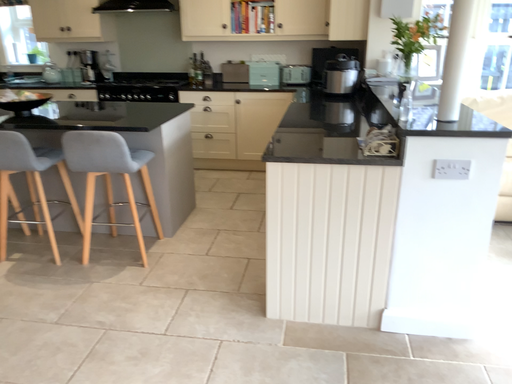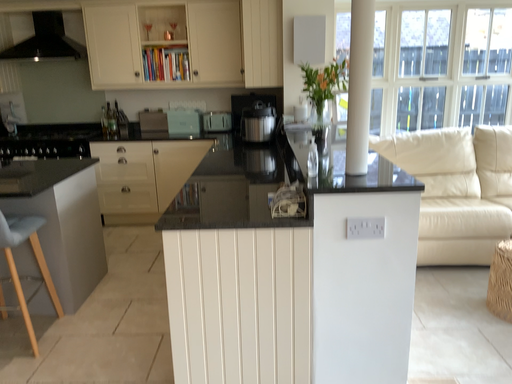
Question: How did the camera likely rotate when shooting the video?

Choices:
 (A) rotated left
 (B) rotated right

Answer: (B)